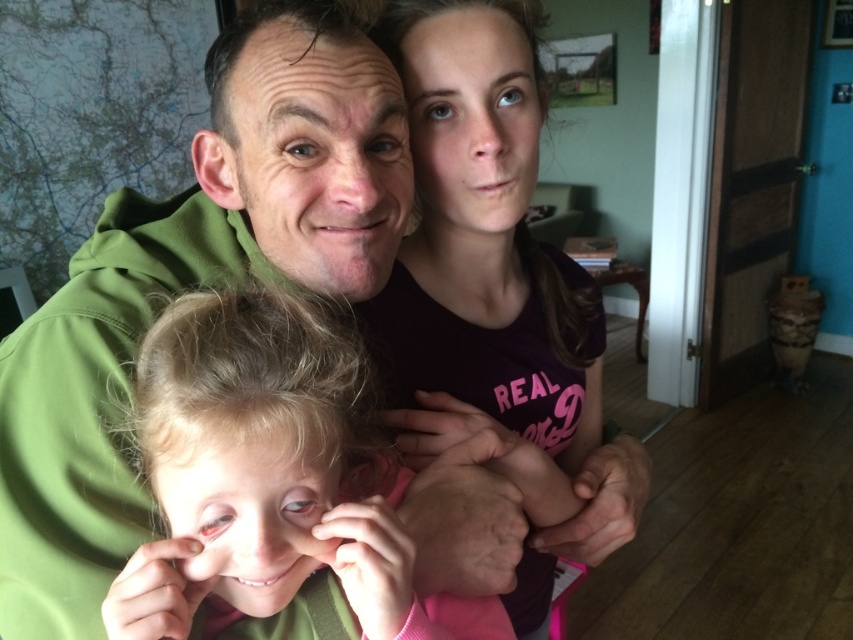
Looking at the scene described, which object is positioned to the left of the other between the green matte hoodie at center and the matte purple shirt at upper center?

The green matte hoodie at center is positioned to the left of the matte purple shirt at upper center.

In the image, you see the green matte hoodie at center and the blonde hair at center. Which one is positioned to the left?

The green matte hoodie at center is to the left of blonde hair at center.